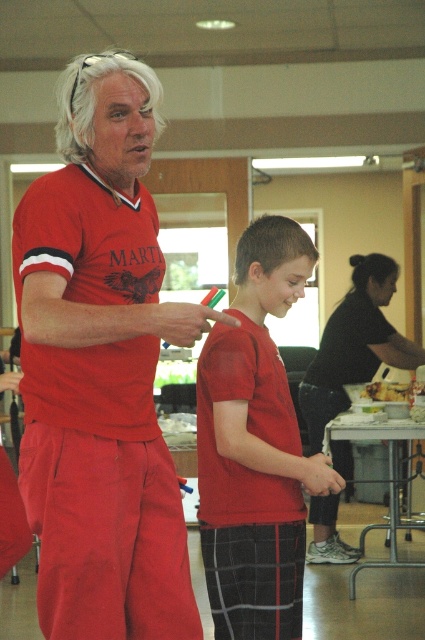
Is matte red shirt at center closer to camera compared to smooth white cheese at center?

That is True.

You are a GUI agent. You are given a task and a screenshot of the screen. Output one action in this format:
    pyautogui.click(x=<x>, y=<y>)
    Task: Click on the matte red shirt at center
    The height and width of the screenshot is (640, 425).
    Given the screenshot: What is the action you would take?
    pyautogui.click(x=101, y=369)

Can you confirm if matte red shirt at center is bigger than matte red t-shirt at center?

Yes, matte red shirt at center is bigger than matte red t-shirt at center.

Between matte red shirt at center and matte red t-shirt at center, which one is positioned higher?

Positioned higher is matte red shirt at center.

Measure the distance between point (187, 308) and camera.

Point (187, 308) and camera are 2.05 meters apart.

Locate an element on the screen. The image size is (425, 640). matte red shirt at center is located at coordinates (101, 369).

Is matte red t-shirt at center to the left of smooth white cheese at center from the viewer's perspective?

Yes, matte red t-shirt at center is to the left of smooth white cheese at center.

Is point (252, 592) closer to camera compared to point (416, 384)?

Yes, it is in front of point (416, 384).

Which is behind, point (277, 304) or point (393, 401)?

The point (393, 401) is more distant.

Where is `matte red t-shirt at center`? The height and width of the screenshot is (640, 425). matte red t-shirt at center is located at coordinates (255, 445).